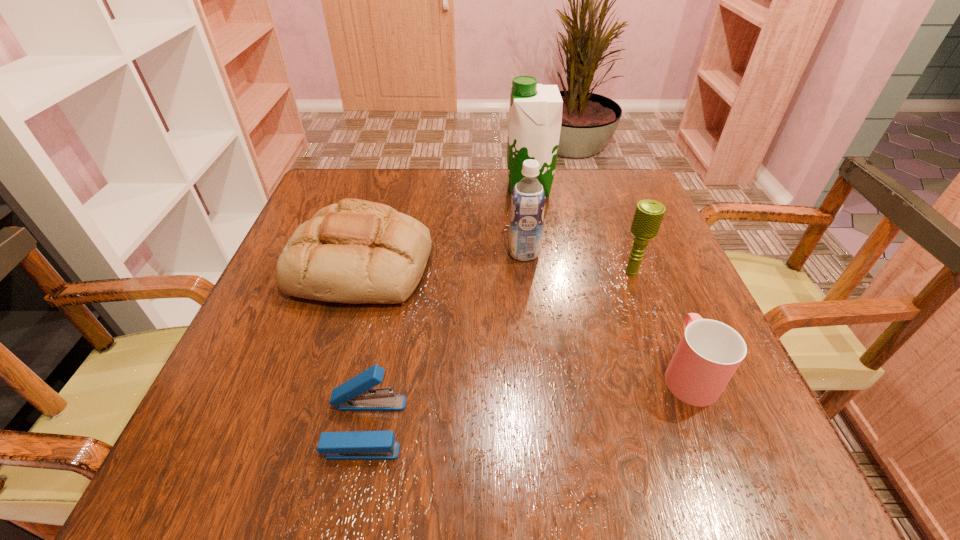
In order to click on free space located 0.260m on the front-facing side of the farther soya milk in this screenshot , I will do `click(406, 187)`.

Find the location of `vacant position located on the label of the shorter soya milk`. vacant position located on the label of the shorter soya milk is located at coordinates (339, 253).

You are a GUI agent. You are given a task and a screenshot of the screen. Output one action in this format:
    pyautogui.click(x=<x>, y=<y>)
    Task: Click on the free region located on the label of the shorter soya milk
    
    Given the screenshot: What is the action you would take?
    pyautogui.click(x=426, y=253)

Where is `vacant area situated 0.180m on the label of the shorter soya milk`? The image size is (960, 540). vacant area situated 0.180m on the label of the shorter soya milk is located at coordinates (426, 253).

The height and width of the screenshot is (540, 960). In order to click on vacant space located on the front of the microphone in this screenshot , I will do `click(669, 373)`.

This screenshot has height=540, width=960. What are the coordinates of `vacant area situated on the front of the bread` in the screenshot? It's located at (322, 406).

Locate an element on the screen. This screenshot has height=540, width=960. vacant space located on the side of the fifth tallest object with the handle is located at coordinates (662, 310).

Locate an element on the screen. The width and height of the screenshot is (960, 540). free space located 0.210m on the side of the fifth tallest object with the handle is located at coordinates (643, 265).

You are a GUI agent. You are given a task and a screenshot of the screen. Output one action in this format:
    pyautogui.click(x=<x>, y=<y>)
    Task: Click on the vacant space located on the side of the fifth tallest object with the handle
    
    Given the screenshot: What is the action you would take?
    [628, 228]

Identify the location of free point located on the right of the shortest object. (456, 427).